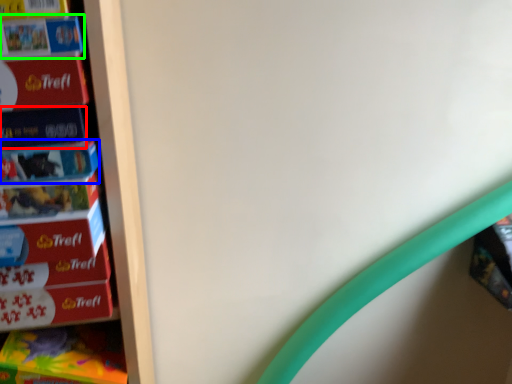
Question: Which is nearer to the paperback book (highlighted by a red box)? paperback book (highlighted by a blue box) or book (highlighted by a green box).

Choices:
 (A) paperback book
 (B) book

Answer: (A)